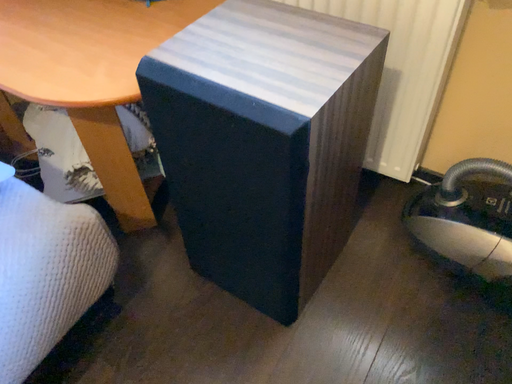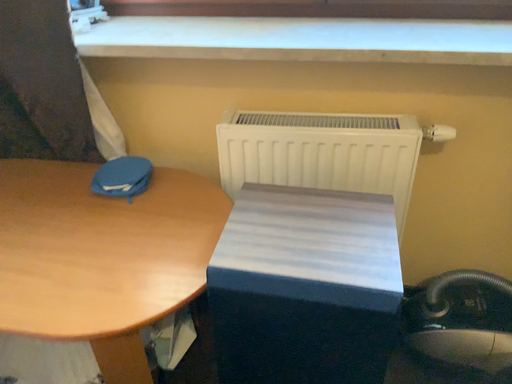
Question: How did the camera likely rotate when shooting the video?

Choices:
 (A) rotated downward
 (B) rotated upward

Answer: (B)